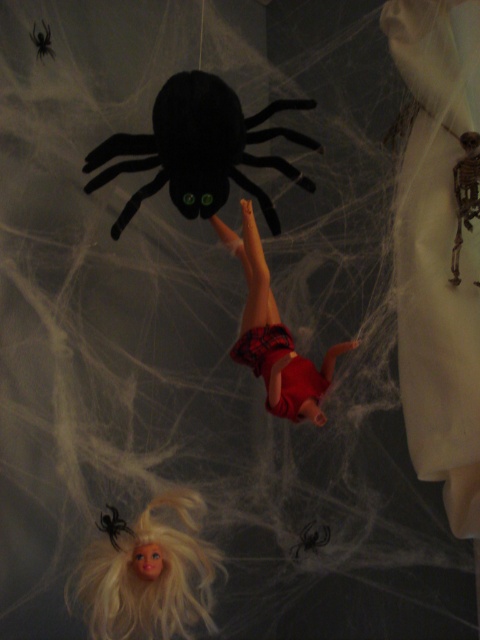
You are a child trying to rescue the blonde hair doll at lower left from the black fuzzy spider at lower left. Based on their positions, which one is closer to the ground?

The blonde hair doll at lower left is located below the black fuzzy spider at lower left, so the doll is closer to the ground than the spider.

Looking at this image, you are a child playing a game of hide and seek in this Halloween scene. You need to hide behind an object that is closer to you. Which object should you choose between the blonde hair doll at lower left and the black fuzzy spider at upper left?

You should hide behind the blonde hair doll at lower left because it is closer to the viewer than the black fuzzy spider at upper left.

You are a child who wants to play with the black fuzzy spider at upper left and the matte red shorts at center. Which object is larger in size?

The matte red shorts at center is bigger than the black fuzzy spider at upper left.